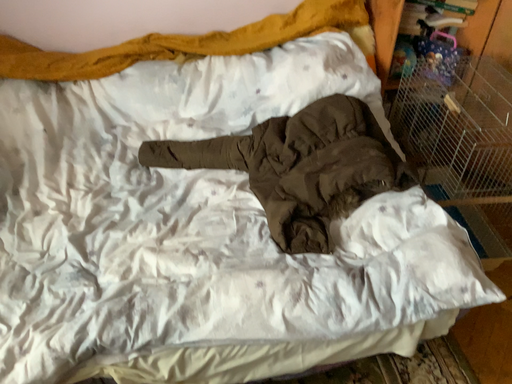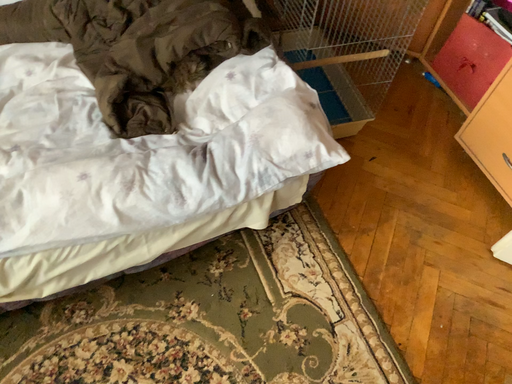
Question: Which way did the camera rotate in the video?

Choices:
 (A) rotated left
 (B) rotated right

Answer: (B)